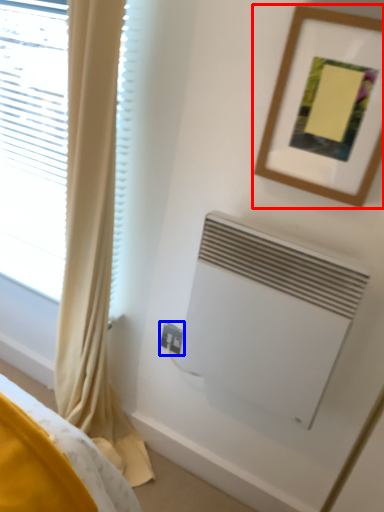
Question: Among these objects, which one is nearest to the camera, picture frame (highlighted by a red box) or electric outlet (highlighted by a blue box)?

Choices:
 (A) picture frame
 (B) electric outlet

Answer: (A)